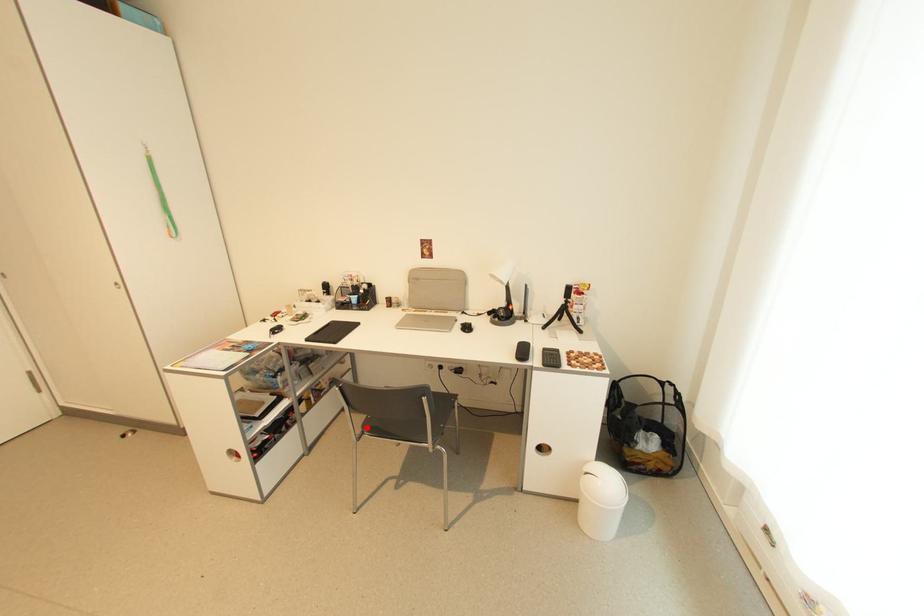
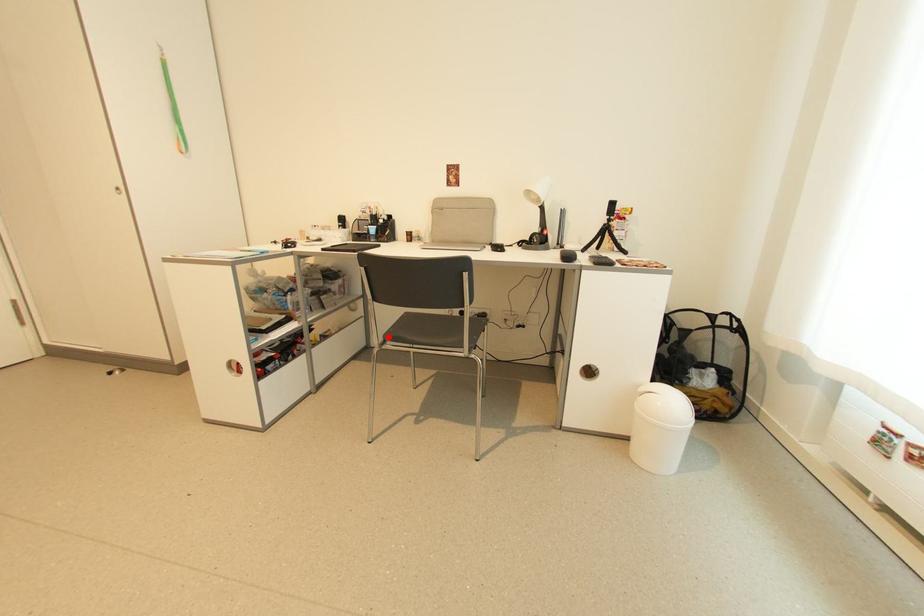
I am providing you with two images of the same scene from different viewpoints. A red point is marked on the first image and another point is marked on the second image. Are the points marked in image1 and image2 representing the same 3D position?

Yes